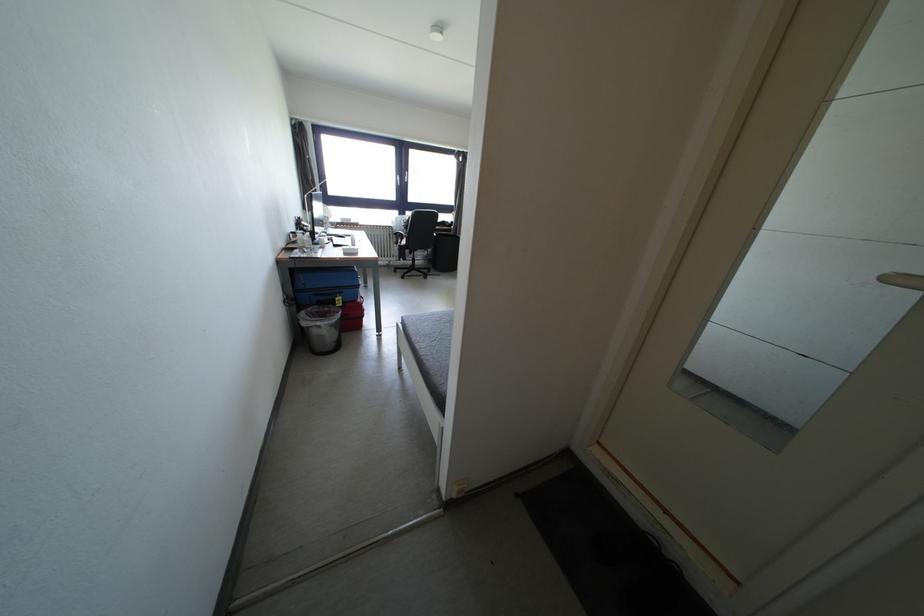
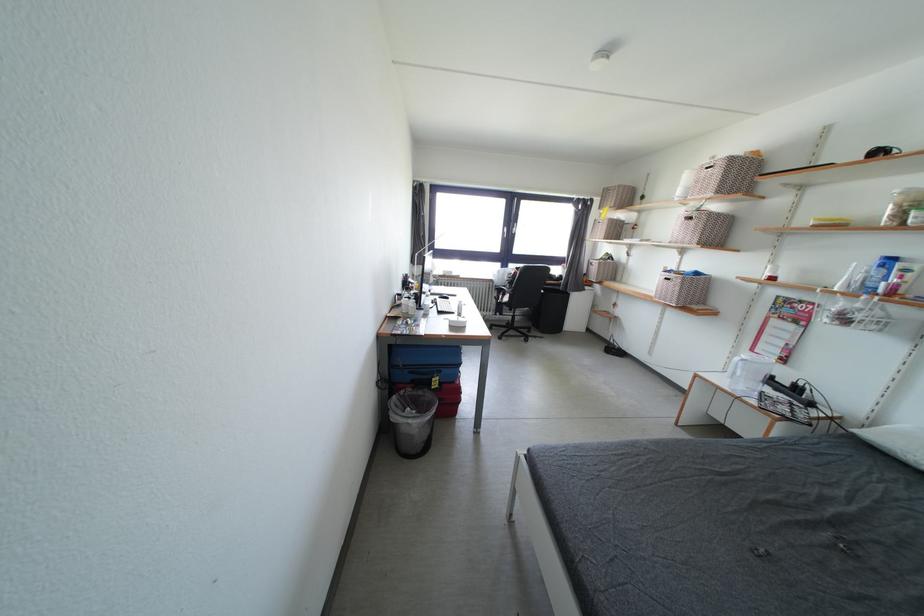
The point at (x=324, y=328) is marked in the first image. Where is the corresponding point in the second image?

(417, 426)